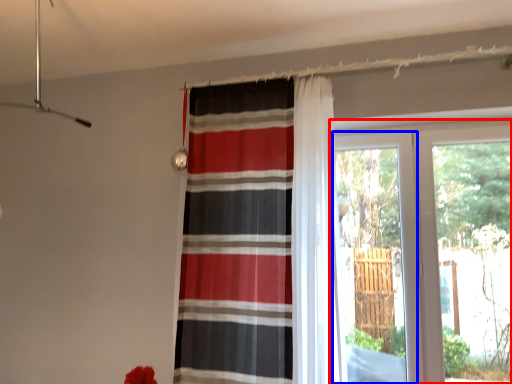
Question: Which object appears farthest to the camera in this image, window (highlighted by a red box) or screen door (highlighted by a blue box)?

Choices:
 (A) window
 (B) screen door

Answer: (B)